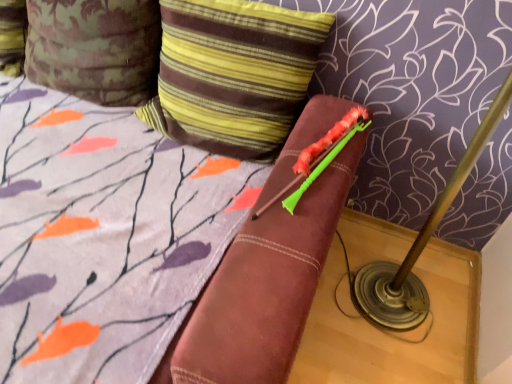
Identify the location of camouflage fabric pillow at upper left, marked as the 2th pillow in a right-to-left arrangement. Image resolution: width=512 pixels, height=384 pixels. (95, 48).

What do you see at coordinates (95, 48) in the screenshot? This screenshot has height=384, width=512. I see `camouflage fabric pillow at upper left, placed as the 1th pillow when sorted from left to right` at bounding box center [95, 48].

Describe the element at coordinates (233, 74) in the screenshot. Image resolution: width=512 pixels, height=384 pixels. I see `striped fabric pillow at upper center, the 2th pillow viewed from the left` at that location.

The image size is (512, 384). Identify the location of striped fabric pillow at upper center, the 2th pillow viewed from the left. (233, 74).

The width and height of the screenshot is (512, 384). In order to click on camouflage fabric pillow at upper left, marked as the 2th pillow in a right-to-left arrangement in this screenshot , I will do pyautogui.click(x=95, y=48).

In the image, is camouflage fabric pillow at upper left, marked as the 2th pillow in a right-to-left arrangement, on the left side or the right side of striped fabric pillow at upper center, the first pillow in the right-to-left sequence?

camouflage fabric pillow at upper left, marked as the 2th pillow in a right-to-left arrangement, is to the left of striped fabric pillow at upper center, the first pillow in the right-to-left sequence.

Which object is further away from the camera taking this photo, camouflage fabric pillow at upper left, placed as the 1th pillow when sorted from left to right, or striped fabric pillow at upper center, the first pillow in the right-to-left sequence?

camouflage fabric pillow at upper left, placed as the 1th pillow when sorted from left to right.

Which point is more forward, (158,56) or (262,130)?

Point (262,130)

From the image's perspective, between camouflage fabric pillow at upper left, marked as the 2th pillow in a right-to-left arrangement, and striped fabric pillow at upper center, the 2th pillow viewed from the left, which one is located above?

camouflage fabric pillow at upper left, marked as the 2th pillow in a right-to-left arrangement, from the image's perspective.

From a real-world perspective, is camouflage fabric pillow at upper left, placed as the 1th pillow when sorted from left to right, above or below striped fabric pillow at upper center, the first pillow in the right-to-left sequence?

camouflage fabric pillow at upper left, placed as the 1th pillow when sorted from left to right, is situated higher than striped fabric pillow at upper center, the first pillow in the right-to-left sequence, in the real world.

Which object is thinner, camouflage fabric pillow at upper left, marked as the 2th pillow in a right-to-left arrangement, or striped fabric pillow at upper center, the 2th pillow viewed from the left?

striped fabric pillow at upper center, the 2th pillow viewed from the left.

Can you confirm if camouflage fabric pillow at upper left, marked as the 2th pillow in a right-to-left arrangement, is shorter than striped fabric pillow at upper center, the first pillow in the right-to-left sequence?

In fact, camouflage fabric pillow at upper left, marked as the 2th pillow in a right-to-left arrangement, may be taller than striped fabric pillow at upper center, the first pillow in the right-to-left sequence.

Considering the relative sizes of camouflage fabric pillow at upper left, marked as the 2th pillow in a right-to-left arrangement, and striped fabric pillow at upper center, the 2th pillow viewed from the left, in the image provided, is camouflage fabric pillow at upper left, marked as the 2th pillow in a right-to-left arrangement, smaller than striped fabric pillow at upper center, the 2th pillow viewed from the left,?

Yes, camouflage fabric pillow at upper left, marked as the 2th pillow in a right-to-left arrangement, is smaller than striped fabric pillow at upper center, the 2th pillow viewed from the left.

Is striped fabric pillow at upper center, the first pillow in the right-to-left sequence, inside camouflage fabric pillow at upper left, marked as the 2th pillow in a right-to-left arrangement?

That's incorrect, striped fabric pillow at upper center, the first pillow in the right-to-left sequence, is not inside camouflage fabric pillow at upper left, marked as the 2th pillow in a right-to-left arrangement.

Is camouflage fabric pillow at upper left, marked as the 2th pillow in a right-to-left arrangement, far away from striped fabric pillow at upper center, the first pillow in the right-to-left sequence?

No, there isn't a large distance between camouflage fabric pillow at upper left, marked as the 2th pillow in a right-to-left arrangement, and striped fabric pillow at upper center, the first pillow in the right-to-left sequence.

Is camouflage fabric pillow at upper left, marked as the 2th pillow in a right-to-left arrangement, turned away from striped fabric pillow at upper center, the first pillow in the right-to-left sequence?

That's not correct — camouflage fabric pillow at upper left, marked as the 2th pillow in a right-to-left arrangement, is not looking away from striped fabric pillow at upper center, the first pillow in the right-to-left sequence.

Consider the image. What's the angular difference between camouflage fabric pillow at upper left, placed as the 1th pillow when sorted from left to right, and striped fabric pillow at upper center, the first pillow in the right-to-left sequence,'s facing directions?

There is a 0.000178-degree angle between the facing directions of camouflage fabric pillow at upper left, placed as the 1th pillow when sorted from left to right, and striped fabric pillow at upper center, the first pillow in the right-to-left sequence.

At what (x,y) coordinates should I click in order to perform the action: click on pillow lying in front of the camouflage fabric pillow at upper left, placed as the 1th pillow when sorted from left to right. Please return your answer as a coordinate pair (x, y). This screenshot has height=384, width=512. Looking at the image, I should click on (233, 74).

Does striped fabric pillow at upper center, the first pillow in the right-to-left sequence, appear on the left side of camouflage fabric pillow at upper left, placed as the 1th pillow when sorted from left to right?

In fact, striped fabric pillow at upper center, the first pillow in the right-to-left sequence, is to the right of camouflage fabric pillow at upper left, placed as the 1th pillow when sorted from left to right.

Is the depth of striped fabric pillow at upper center, the first pillow in the right-to-left sequence, less than that of camouflage fabric pillow at upper left, placed as the 1th pillow when sorted from left to right?

Yes, striped fabric pillow at upper center, the first pillow in the right-to-left sequence, is in front of camouflage fabric pillow at upper left, placed as the 1th pillow when sorted from left to right.

Is point (189, 20) in front of point (89, 99)?

Yes.

From the image's perspective, between striped fabric pillow at upper center, the 2th pillow viewed from the left, and camouflage fabric pillow at upper left, marked as the 2th pillow in a right-to-left arrangement, who is located below?

striped fabric pillow at upper center, the 2th pillow viewed from the left, is shown below in the image.

From a real-world perspective, is striped fabric pillow at upper center, the first pillow in the right-to-left sequence, beneath camouflage fabric pillow at upper left, placed as the 1th pillow when sorted from left to right?

Yes, from a real-world perspective, striped fabric pillow at upper center, the first pillow in the right-to-left sequence, is below camouflage fabric pillow at upper left, placed as the 1th pillow when sorted from left to right.

Which of these two, striped fabric pillow at upper center, the 2th pillow viewed from the left, or camouflage fabric pillow at upper left, marked as the 2th pillow in a right-to-left arrangement, is wider?

Wider between the two is camouflage fabric pillow at upper left, marked as the 2th pillow in a right-to-left arrangement.

From their relative heights in the image, would you say striped fabric pillow at upper center, the first pillow in the right-to-left sequence, is taller or shorter than camouflage fabric pillow at upper left, placed as the 1th pillow when sorted from left to right?

A: Considering their sizes, striped fabric pillow at upper center, the first pillow in the right-to-left sequence, has less height than camouflage fabric pillow at upper left, placed as the 1th pillow when sorted from left to right.

Who is smaller, striped fabric pillow at upper center, the 2th pillow viewed from the left, or camouflage fabric pillow at upper left, marked as the 2th pillow in a right-to-left arrangement?

Smaller between the two is camouflage fabric pillow at upper left, marked as the 2th pillow in a right-to-left arrangement.

Can we say striped fabric pillow at upper center, the 2th pillow viewed from the left, lies outside camouflage fabric pillow at upper left, placed as the 1th pillow when sorted from left to right?

That's correct, striped fabric pillow at upper center, the 2th pillow viewed from the left, is outside of camouflage fabric pillow at upper left, placed as the 1th pillow when sorted from left to right.

Is striped fabric pillow at upper center, the first pillow in the right-to-left sequence, beside camouflage fabric pillow at upper left, placed as the 1th pillow when sorted from left to right?

No, striped fabric pillow at upper center, the first pillow in the right-to-left sequence, is not in contact with camouflage fabric pillow at upper left, placed as the 1th pillow when sorted from left to right.

Is striped fabric pillow at upper center, the 2th pillow viewed from the left, looking in the opposite direction of camouflage fabric pillow at upper left, placed as the 1th pillow when sorted from left to right?

No.

How many degrees apart are the facing directions of striped fabric pillow at upper center, the 2th pillow viewed from the left, and camouflage fabric pillow at upper left, marked as the 2th pillow in a right-to-left arrangement?

The facing directions of striped fabric pillow at upper center, the 2th pillow viewed from the left, and camouflage fabric pillow at upper left, marked as the 2th pillow in a right-to-left arrangement, are 0.000178 degrees apart.

How much distance is there between striped fabric pillow at upper center, the first pillow in the right-to-left sequence, and camouflage fabric pillow at upper left, placed as the 1th pillow when sorted from left to right?

12.00 inches.

Identify the location of pillow above the striped fabric pillow at upper center, the first pillow in the right-to-left sequence (from a real-world perspective). The height and width of the screenshot is (384, 512). (95, 48).

The width and height of the screenshot is (512, 384). Identify the location of pillow that is on the left side of striped fabric pillow at upper center, the first pillow in the right-to-left sequence. (95, 48).

At what (x,y) coordinates should I click in order to perform the action: click on pillow in front of the camouflage fabric pillow at upper left, placed as the 1th pillow when sorted from left to right. Please return your answer as a coordinate pair (x, y). This screenshot has height=384, width=512. Looking at the image, I should click on (233, 74).